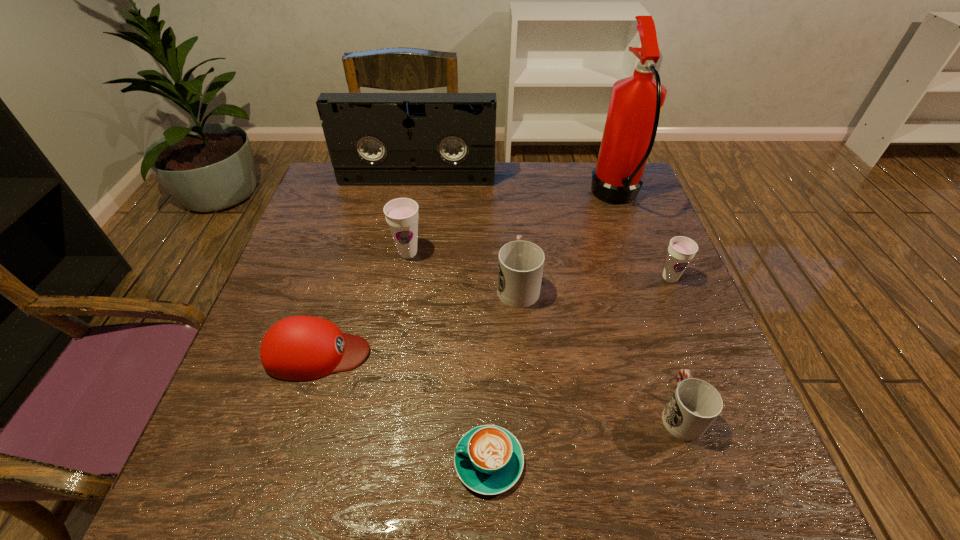
Where is `red fire extinguisher`? Image resolution: width=960 pixels, height=540 pixels. red fire extinguisher is located at coordinates (636, 102).

Where is `the tallest object`? The height and width of the screenshot is (540, 960). the tallest object is located at coordinates (636, 102).

Identify the location of gray videotape. (374, 139).

Find the location of a particular element. The height and width of the screenshot is (540, 960). the seventh shortest object is located at coordinates (374, 139).

This screenshot has width=960, height=540. What are the coordinates of `the third tallest object` in the screenshot? It's located at (401, 214).

Identify the location of the farther purple cup. (401, 214).

This screenshot has width=960, height=540. What are the coordinates of `the third cup from right to left` in the screenshot? It's located at (520, 265).

The width and height of the screenshot is (960, 540). I want to click on the bigger red cup, so click(520, 265).

Image resolution: width=960 pixels, height=540 pixels. What are the coordinates of `the nearer purple cup` in the screenshot? It's located at (681, 250).

At what (x,y) coordinates should I click in order to perform the action: click on the rightmost cup. Please return your answer as a coordinate pair (x, y). The height and width of the screenshot is (540, 960). Looking at the image, I should click on (681, 250).